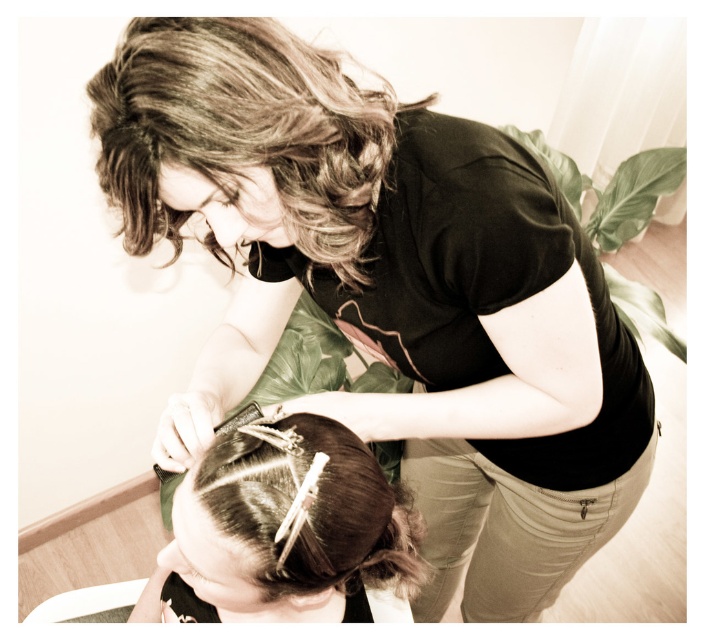
Is curly brown hair at upper center above dark brown silky hair at lower center?

Correct, curly brown hair at upper center is located above dark brown silky hair at lower center.

Does curly brown hair at upper center have a greater height compared to dark brown silky hair at lower center?

No.

Does point (247, 147) lie behind point (417, 531)?

No, (247, 147) is closer to viewer.

What are the coordinates of `curly brown hair at upper center` in the screenshot? It's located at pyautogui.click(x=245, y=132).

Is silver metallic hair clip at center taller than dark brown silky hair at lower center?

Indeed, silver metallic hair clip at center has a greater height compared to dark brown silky hair at lower center.

This screenshot has height=640, width=705. What do you see at coordinates (309, 508) in the screenshot?
I see `silver metallic hair clip at center` at bounding box center [309, 508].

At what (x,y) coordinates should I click in order to perform the action: click on silver metallic hair clip at center. Please return your answer as a coordinate pair (x, y). Looking at the image, I should click on (309, 508).

Between curly brown hair at upper center and silver metallic hair clip at center, which one is positioned higher?

Positioned higher is curly brown hair at upper center.

Can you confirm if curly brown hair at upper center is positioned above silver metallic hair clip at center?

Indeed, curly brown hair at upper center is positioned over silver metallic hair clip at center.

You are a GUI agent. You are given a task and a screenshot of the screen. Output one action in this format:
    pyautogui.click(x=<x>, y=<y>)
    Task: Click on the curly brown hair at upper center
    
    Given the screenshot: What is the action you would take?
    pyautogui.click(x=245, y=132)